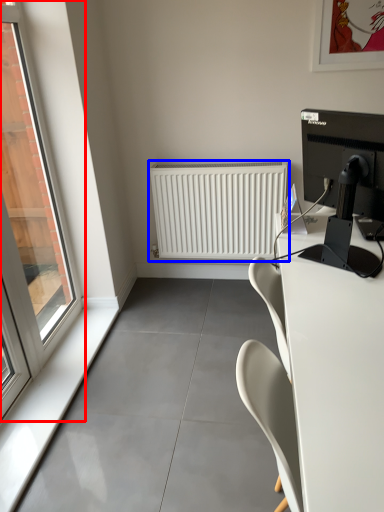
Question: Among these objects, which one is farthest to the camera, window (highlighted by a red box) or radiator (highlighted by a blue box)?

Choices:
 (A) window
 (B) radiator

Answer: (B)